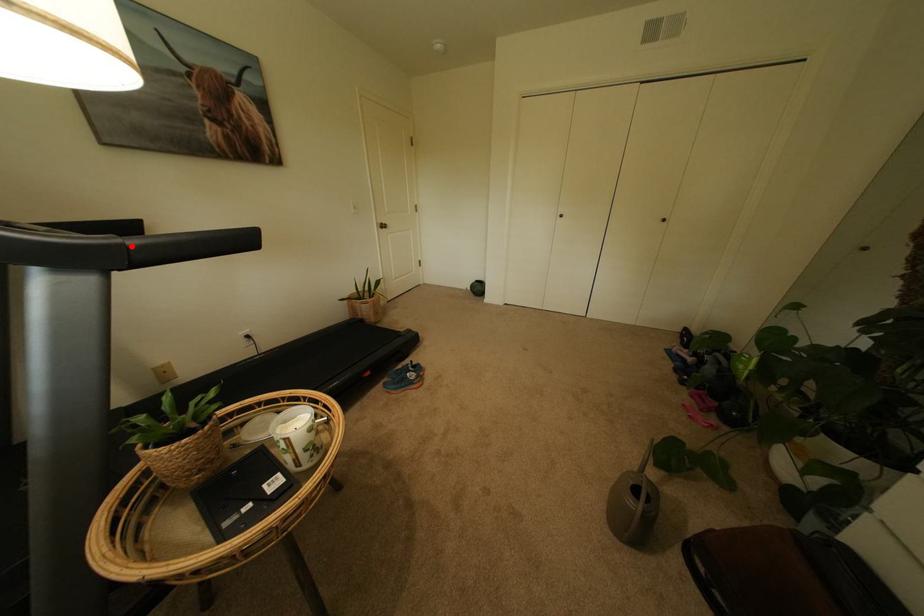
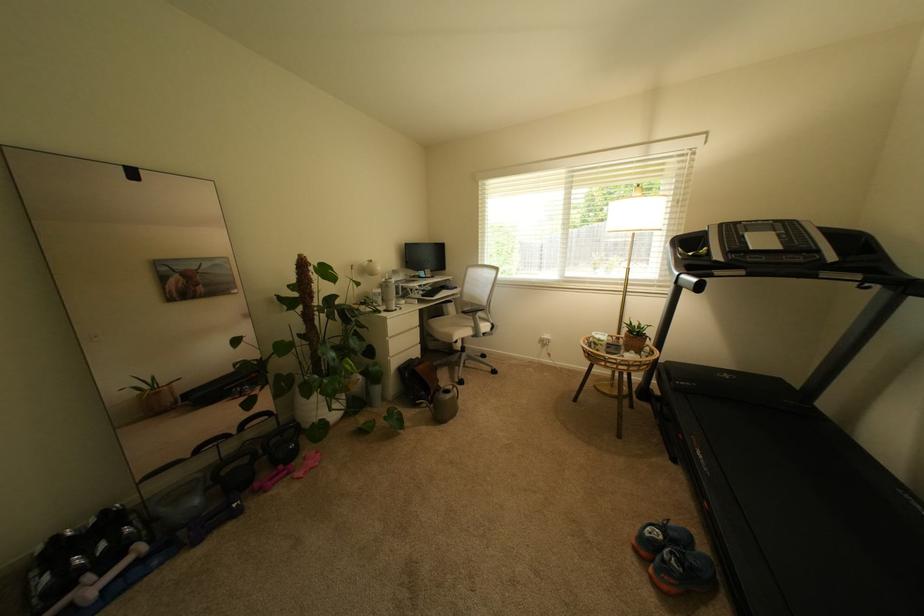
Question: I am providing you with two images of the same scene from different viewpoints. A red point is marked on the first image. Is the red point's position out of view in image 2?

Choices:
 (A) Yes
 (B) No

Answer: (A)